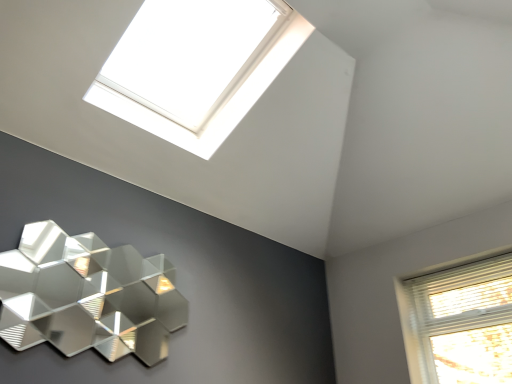
This screenshot has width=512, height=384. Describe the element at coordinates (87, 296) in the screenshot. I see `metallic hexagonal lamp at lower left` at that location.

At what (x,y) coordinates should I click in order to perform the action: click on metallic hexagonal lamp at lower left. Please return your answer as a coordinate pair (x, y). The image size is (512, 384). Looking at the image, I should click on (87, 296).

The height and width of the screenshot is (384, 512). Describe the element at coordinates (216, 91) in the screenshot. I see `white plastic window at upper center` at that location.

In order to face white plastic window at upper center, should I rotate leftwards or rightwards?

Rotate left and turn 8.438 degrees.

Where is `white plastic window at upper center`? The image size is (512, 384). white plastic window at upper center is located at coordinates (216, 91).

What is the approximate width of white plastic window at upper center?

white plastic window at upper center is 32.93 inches in width.

Measure the distance between point (x=292, y=34) and camera.

2.22 meters.

At what (x,y) coordinates should I click in order to perform the action: click on metallic hexagonal lamp at lower left. Please return your answer as a coordinate pair (x, y). Looking at the image, I should click on (87, 296).

Which object is positioned more to the right, white plastic window at upper center or metallic hexagonal lamp at lower left?

white plastic window at upper center is more to the right.

Is white plastic window at upper center in front of or behind metallic hexagonal lamp at lower left in the image?

white plastic window at upper center is positioned farther from the viewer than metallic hexagonal lamp at lower left.

Considering the points (110, 83) and (73, 298), which point is in front, point (110, 83) or point (73, 298)?

The point (110, 83) is closer.

From the image's perspective, between white plastic window at upper center and metallic hexagonal lamp at lower left, which one is located above?

From the image's view, white plastic window at upper center is above.

From a real-world perspective, which is physically below, white plastic window at upper center or metallic hexagonal lamp at lower left?

In real-world perspective, metallic hexagonal lamp at lower left is lower.

Looking at their sizes, would you say white plastic window at upper center is wider or thinner than metallic hexagonal lamp at lower left?

white plastic window at upper center is wider than metallic hexagonal lamp at lower left.

Can you confirm if white plastic window at upper center is taller than metallic hexagonal lamp at lower left?

In fact, white plastic window at upper center may be shorter than metallic hexagonal lamp at lower left.

Does white plastic window at upper center have a smaller size compared to metallic hexagonal lamp at lower left?

Actually, white plastic window at upper center might be larger than metallic hexagonal lamp at lower left.

Would you say white plastic window at upper center is outside metallic hexagonal lamp at lower left?

Yes, white plastic window at upper center is located beyond the bounds of metallic hexagonal lamp at lower left.

Is white plastic window at upper center next to metallic hexagonal lamp at lower left and touching it?

They are not placed beside each other.

Is white plastic window at upper center looking in the opposite direction of metallic hexagonal lamp at lower left?

No, metallic hexagonal lamp at lower left is not at the back of white plastic window at upper center.

How far apart are white plastic window at upper center and metallic hexagonal lamp at lower left?

white plastic window at upper center is 1.79 meters from metallic hexagonal lamp at lower left.

At what (x,y) coordinates should I click in order to perform the action: click on window above the metallic hexagonal lamp at lower left (from a real-world perspective). Please return your answer as a coordinate pair (x, y). Looking at the image, I should click on (216, 91).

Does metallic hexagonal lamp at lower left appear on the right side of white plastic window at upper center?

No.

Which object is more forward, metallic hexagonal lamp at lower left or white plastic window at upper center?

metallic hexagonal lamp at lower left is closer to the camera.

Is point (86, 330) positioned in front of point (138, 33)?

Yes, it is in front of point (138, 33).

From the image's perspective, who appears lower, metallic hexagonal lamp at lower left or white plastic window at upper center?

metallic hexagonal lamp at lower left, from the image's perspective.

From a real-world perspective, who is located lower, metallic hexagonal lamp at lower left or white plastic window at upper center?

metallic hexagonal lamp at lower left is physically lower.

Considering the relative sizes of metallic hexagonal lamp at lower left and white plastic window at upper center in the image provided, is metallic hexagonal lamp at lower left wider than white plastic window at upper center?

No, metallic hexagonal lamp at lower left is not wider than white plastic window at upper center.

Between metallic hexagonal lamp at lower left and white plastic window at upper center, which one has less height?

white plastic window at upper center.

Can you confirm if metallic hexagonal lamp at lower left is bigger than white plastic window at upper center?

Actually, metallic hexagonal lamp at lower left might be smaller than white plastic window at upper center.

Based on the photo, is metallic hexagonal lamp at lower left surrounding white plastic window at upper center?

No, white plastic window at upper center is not surrounded by metallic hexagonal lamp at lower left.

In the scene shown: Is metallic hexagonal lamp at lower left placed right next to white plastic window at upper center?

metallic hexagonal lamp at lower left and white plastic window at upper center are clearly separated.

From the picture: Is metallic hexagonal lamp at lower left aimed at white plastic window at upper center?

No, metallic hexagonal lamp at lower left is not turned towards white plastic window at upper center.

What's the angular difference between metallic hexagonal lamp at lower left and white plastic window at upper center's facing directions?

They differ by 0.783 degrees in their facing directions.

How distant is metallic hexagonal lamp at lower left from white plastic window at upper center?

metallic hexagonal lamp at lower left and white plastic window at upper center are 5.87 feet apart.

This screenshot has width=512, height=384. I want to click on window on the right of metallic hexagonal lamp at lower left, so click(216, 91).

Locate an element on the screen. This screenshot has width=512, height=384. lamp below the white plastic window at upper center (from the image's perspective) is located at coordinates (87, 296).

You are a GUI agent. You are given a task and a screenshot of the screen. Output one action in this format:
    pyautogui.click(x=<x>, y=<y>)
    Task: Click on the lamp that appears in front of the white plastic window at upper center
    
    Given the screenshot: What is the action you would take?
    pyautogui.click(x=87, y=296)